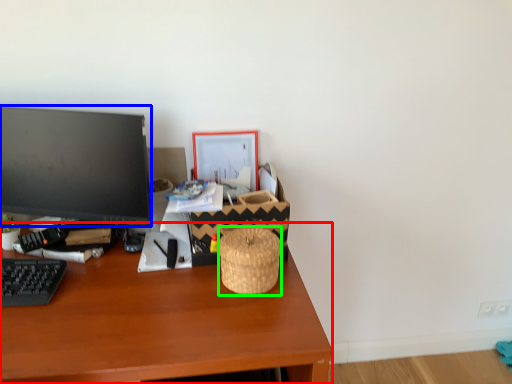
Question: Based on their relative distances, which object is nearer to desk (highlighted by a red box)? Choose from television (highlighted by a blue box) and basket (highlighted by a green box).

Choices:
 (A) television
 (B) basket

Answer: (B)